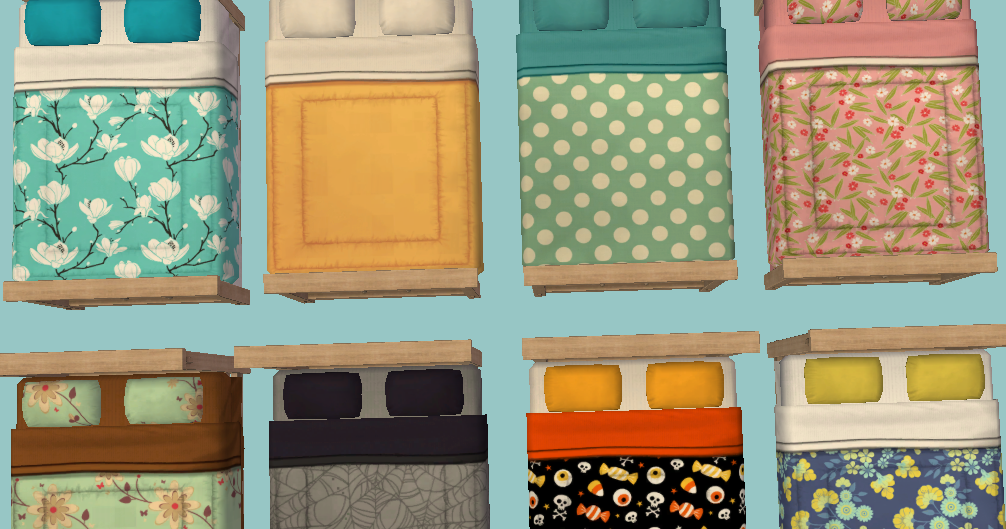
At what (x,y) coordinates should I click in order to perform the action: click on beds. Please return your answer as a coordinate pair (x, y). The width and height of the screenshot is (1006, 529). Looking at the image, I should click on (146, 186), (347, 160), (651, 170), (870, 150), (884, 473), (614, 477), (129, 482).